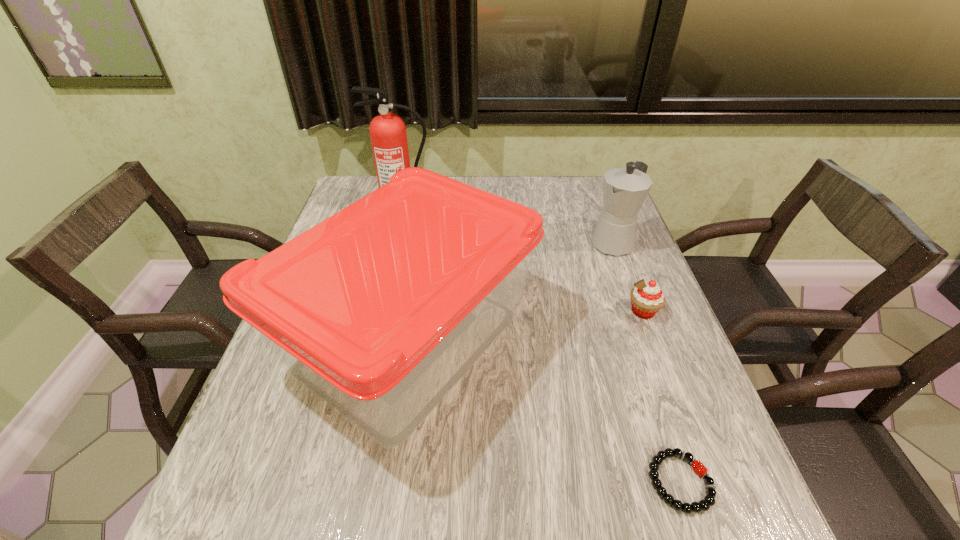
The height and width of the screenshot is (540, 960). I want to click on free space located on the back of the shortest object, so click(656, 407).

Image resolution: width=960 pixels, height=540 pixels. In order to click on object positioned at the far edge in this screenshot , I will do point(388,135).

Find the location of a particular element. object at the near edge is located at coordinates (709, 500).

In order to click on fire extinguisher that is at the left edge in this screenshot , I will do `click(388, 135)`.

Find the location of a particular element. tray at the left edge is located at coordinates (378, 311).

The width and height of the screenshot is (960, 540). I want to click on coffeepot located in the right edge section of the desktop, so click(x=624, y=189).

At what (x,y) coordinates should I click in order to perform the action: click on cupcake that is at the right edge. Please return your answer as a coordinate pair (x, y). This screenshot has width=960, height=540. Looking at the image, I should click on (647, 298).

Where is `bracelet that is at the right edge`? The width and height of the screenshot is (960, 540). bracelet that is at the right edge is located at coordinates (709, 500).

I want to click on object situated at the far left corner, so click(x=388, y=135).

At what (x,y) coordinates should I click in order to perform the action: click on object present at the near right corner. Please return your answer as a coordinate pair (x, y). This screenshot has height=540, width=960. Looking at the image, I should click on (709, 500).